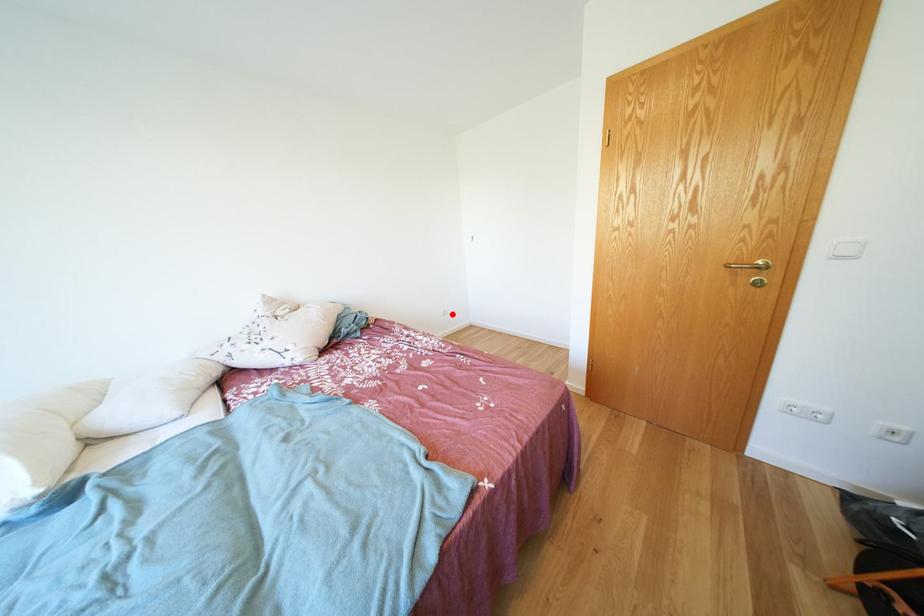
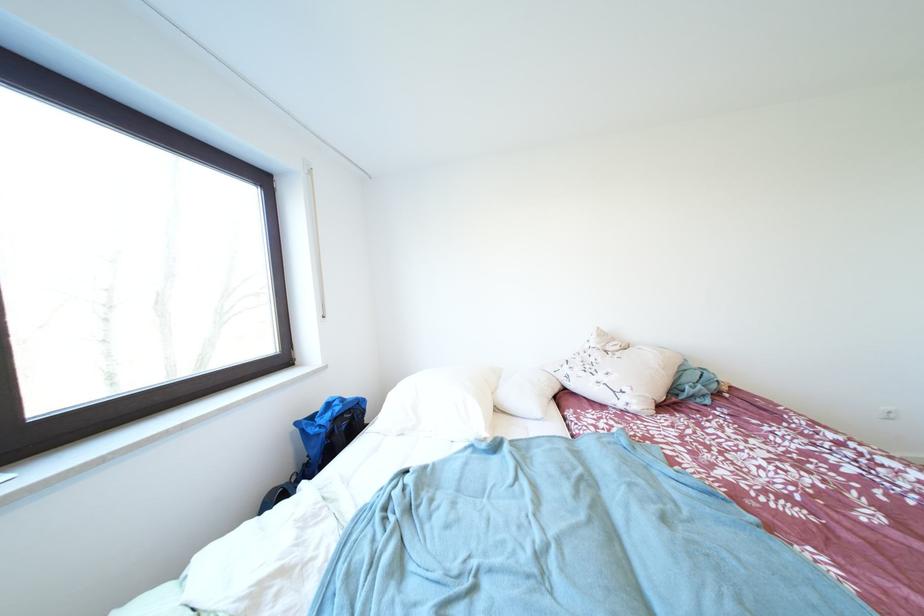
Locate, in the second image, the point that corresponds to the highlighted location in the first image.

(895, 413)